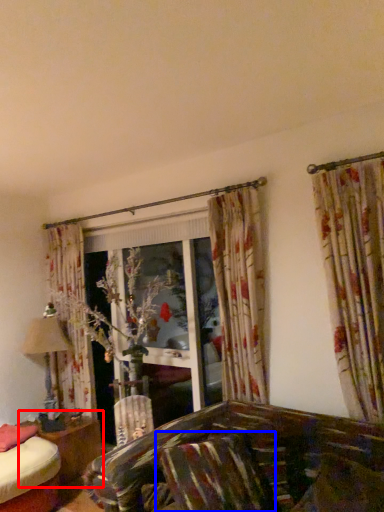
Question: Which of the following is the farthest to the observer, table (highlighted by a red box) or pillow (highlighted by a blue box)?

Choices:
 (A) table
 (B) pillow

Answer: (A)